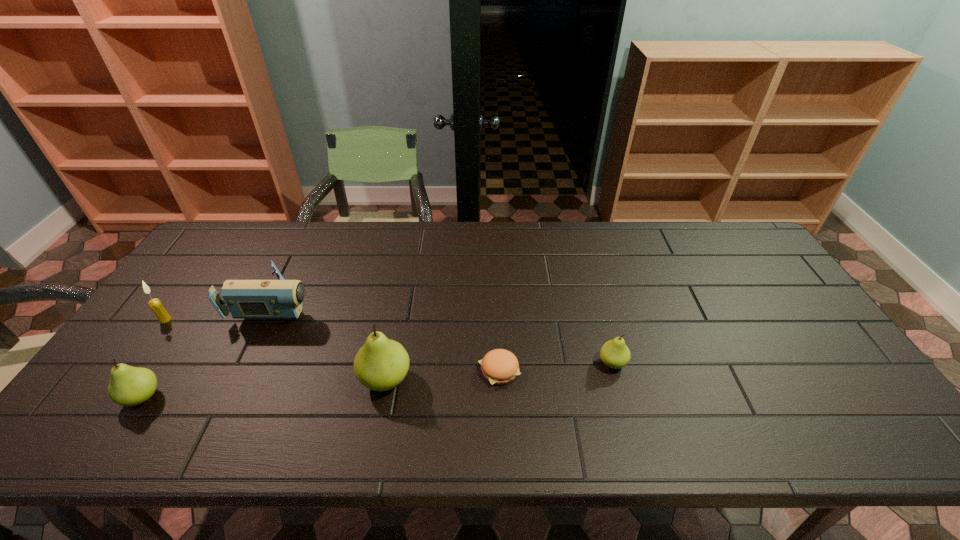
The width and height of the screenshot is (960, 540). In order to click on vacant space that satisfies the following two spatial constraints: 1. on the back side of the rightmost pear; 2. on the right side of the second object from left to right in this screenshot , I will do `click(165, 363)`.

You are a GUI agent. You are given a task and a screenshot of the screen. Output one action in this format:
    pyautogui.click(x=<x>, y=<y>)
    Task: Click on the vacant position in the image that satisfies the following two spatial constraints: 1. on the side of the second shortest object with the flip-out screen; 2. on the right side of the fourth object from right to left
    The image size is (960, 540).
    Given the screenshot: What is the action you would take?
    pyautogui.click(x=249, y=363)